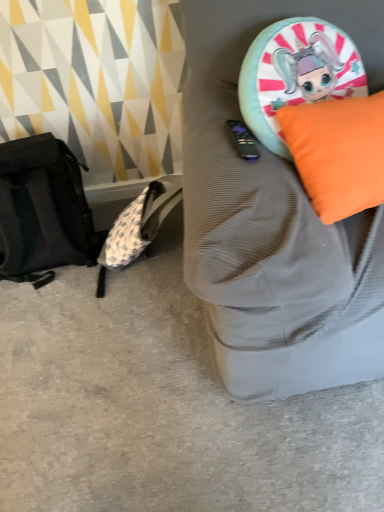
Question: Can you confirm if black fabric backpack at left is smaller than orange fabric cushion at upper right?

Choices:
 (A) no
 (B) yes

Answer: (B)

Question: Is black fabric backpack at left further to camera compared to orange fabric cushion at upper right?

Choices:
 (A) no
 (B) yes

Answer: (B)

Question: From a real-world perspective, is black fabric backpack at left located higher than orange fabric cushion at upper right?

Choices:
 (A) yes
 (B) no

Answer: (B)

Question: Considering the relative sizes of black fabric backpack at left and orange fabric cushion at upper right in the image provided, is black fabric backpack at left thinner than orange fabric cushion at upper right?

Choices:
 (A) yes
 (B) no

Answer: (B)

Question: Is black fabric backpack at left in front of orange fabric cushion at upper right?

Choices:
 (A) yes
 (B) no

Answer: (B)

Question: From the image's perspective, relative to orange fabric pillow at upper right, is orange fabric cushion at upper right above or below?

Choices:
 (A) below
 (B) above

Answer: (B)

Question: Considering their positions, is orange fabric cushion at upper right located in front of or behind orange fabric pillow at upper right?

Choices:
 (A) behind
 (B) front

Answer: (B)

Question: Considering the positions of point (339, 229) and point (365, 138), is point (339, 229) closer or farther from the camera than point (365, 138)?

Choices:
 (A) closer
 (B) farther

Answer: (A)

Question: Considering the positions of orange fabric cushion at upper right and orange fabric pillow at upper right in the image, is orange fabric cushion at upper right taller or shorter than orange fabric pillow at upper right?

Choices:
 (A) tall
 (B) short

Answer: (A)

Question: Considering the positions of point (29, 160) and point (332, 144), is point (29, 160) closer or farther from the camera than point (332, 144)?

Choices:
 (A) farther
 (B) closer

Answer: (A)

Question: Considering the positions of black fabric messenger bag at left and orange fabric pillow at upper right in the image, is black fabric messenger bag at left bigger or smaller than orange fabric pillow at upper right?

Choices:
 (A) small
 (B) big

Answer: (B)

Question: Is black fabric messenger bag at left wider or thinner than orange fabric pillow at upper right?

Choices:
 (A) thin
 (B) wide

Answer: (B)

Question: Which is correct: black fabric messenger bag at left is inside orange fabric pillow at upper right, or outside of it?

Choices:
 (A) inside
 (B) outside

Answer: (B)

Question: Looking at their shapes, would you say orange fabric cushion at upper right is wider or thinner than black fabric backpack at left?

Choices:
 (A) thin
 (B) wide

Answer: (A)

Question: Would you say orange fabric cushion at upper right is to the left or to the right of black fabric backpack at left in the picture?

Choices:
 (A) left
 (B) right

Answer: (B)